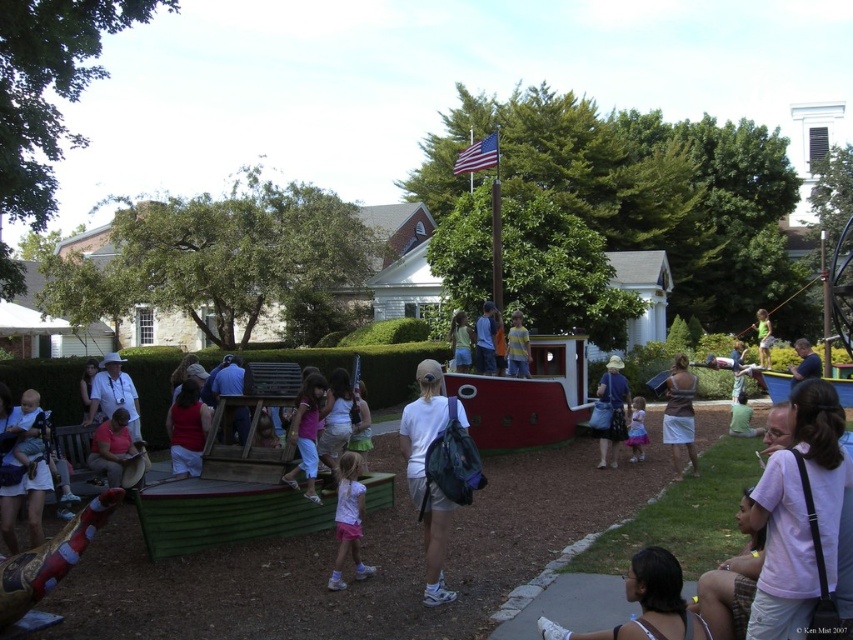
Question: Is pink cotton shirt at lower right above green fabric swing at center?

Choices:
 (A) no
 (B) yes

Answer: (A)

Question: Among these objects, which one is farthest from the camera?

Choices:
 (A) red matte boat at center
 (B) pink satin dress at center
 (C) light blue denim shorts at center
 (D) pink fabric dress at center

Answer: (C)

Question: Which point is closer to the camera taking this photo?

Choices:
 (A) (737, 365)
 (B) (740, 412)
 (C) (808, 483)

Answer: (C)

Question: Is pink cotton shirt at lower right above green fabric swing at center?

Choices:
 (A) no
 (B) yes

Answer: (A)

Question: Among these points, which one is nearest to the camera?

Choices:
 (A) (757, 349)
 (B) (201, 490)

Answer: (B)

Question: Is white tank top at lower right to the right of pink satin dress at center from the viewer's perspective?

Choices:
 (A) yes
 (B) no

Answer: (B)